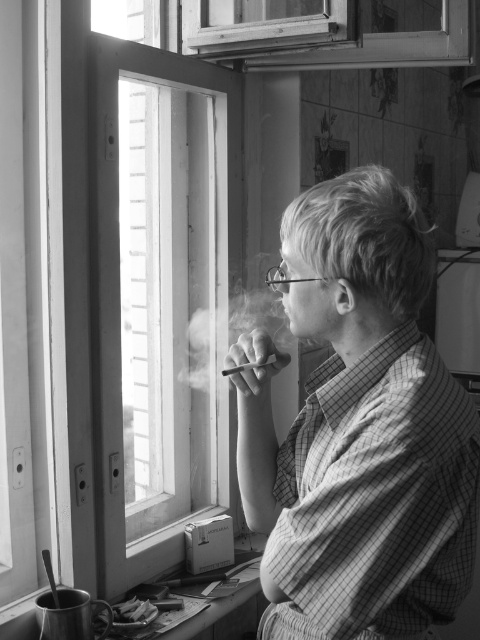
In the scene shown: Who is shorter, checkered fabric shirt at center or smooth gray cigarette at center?

With less height is smooth gray cigarette at center.

Describe the element at coordinates (359, 428) in the screenshot. I see `checkered fabric shirt at center` at that location.

This screenshot has width=480, height=640. What are the coordinates of `checkered fabric shirt at center` in the screenshot? It's located at (359, 428).

Identify the location of checkered fabric shirt at center. (359, 428).

Does checkered fabric shirt at center appear over smoketransparentsmoke at center?

No.

Between checkered fabric shirt at center and smoketransparentsmoke at center, which one has less height?

smoketransparentsmoke at center is shorter.

You are a GUI agent. You are given a task and a screenshot of the screen. Output one action in this format:
    pyautogui.click(x=<x>, y=<y>)
    Task: Click on the checkered fabric shirt at center
    
    Given the screenshot: What is the action you would take?
    pyautogui.click(x=359, y=428)

Find the location of `checkered fabric shirt at center`. checkered fabric shirt at center is located at coordinates (359, 428).

Does smoketransparentsmoke at center appear on the right side of smooth gray cigarette at center?

Incorrect, smoketransparentsmoke at center is not on the right side of smooth gray cigarette at center.

At what (x,y) coordinates should I click in order to perform the action: click on smoketransparentsmoke at center. Please return your answer as a coordinate pair (x, y). Image resolution: width=480 pixels, height=640 pixels. Looking at the image, I should click on (229, 333).